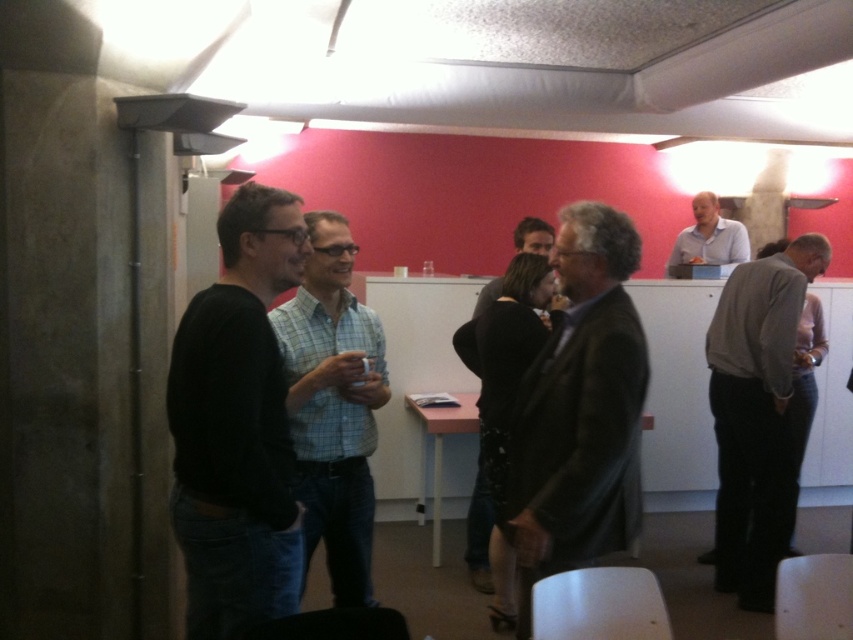
Between black matte sweater at left and gray wool sweater at right, which one appears on the left side from the viewer's perspective?

black matte sweater at left is more to the left.

Does point (212, 522) come farther from viewer compared to point (780, 333)?

No, it is in front of (780, 333).

Identify the location of black matte sweater at left. The image size is (853, 640). (236, 426).

Between dark brown leather jacket at center and light blue checkered shirt at center, which one has less height?

dark brown leather jacket at center

Is point (604, 259) in front of point (334, 529)?

Yes.

Find the location of a particular element. The height and width of the screenshot is (640, 853). dark brown leather jacket at center is located at coordinates (x=579, y=410).

Which of these two, black matte sweater at left or light blue shirt at upper right, stands taller?

black matte sweater at left is taller.

Between black matte sweater at left and light blue shirt at upper right, which one is positioned lower?

black matte sweater at left is lower down.

Which is behind, point (212, 316) or point (677, 252)?

Positioned behind is point (677, 252).

You are a GUI agent. You are given a task and a screenshot of the screen. Output one action in this format:
    pyautogui.click(x=<x>, y=<y>)
    Task: Click on the black matte sweater at left
    The image size is (853, 640).
    Given the screenshot: What is the action you would take?
    click(236, 426)